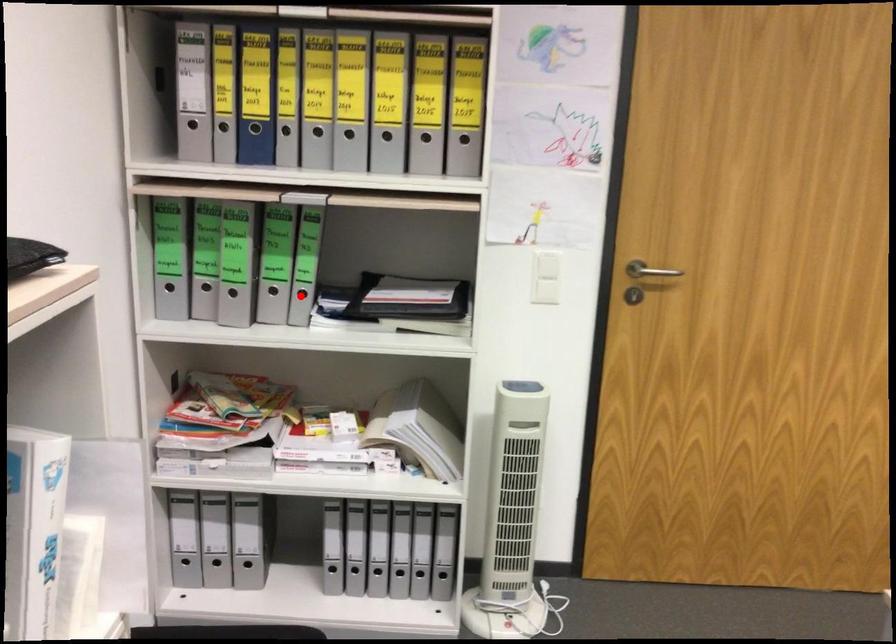
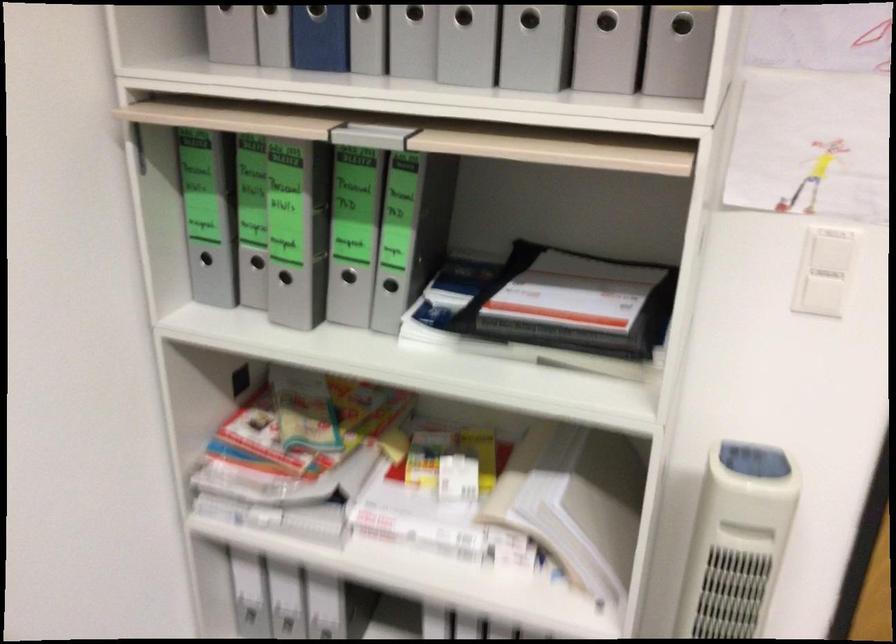
In the second image, find the point that corresponds to the highlighted location in the first image.

(390, 285)